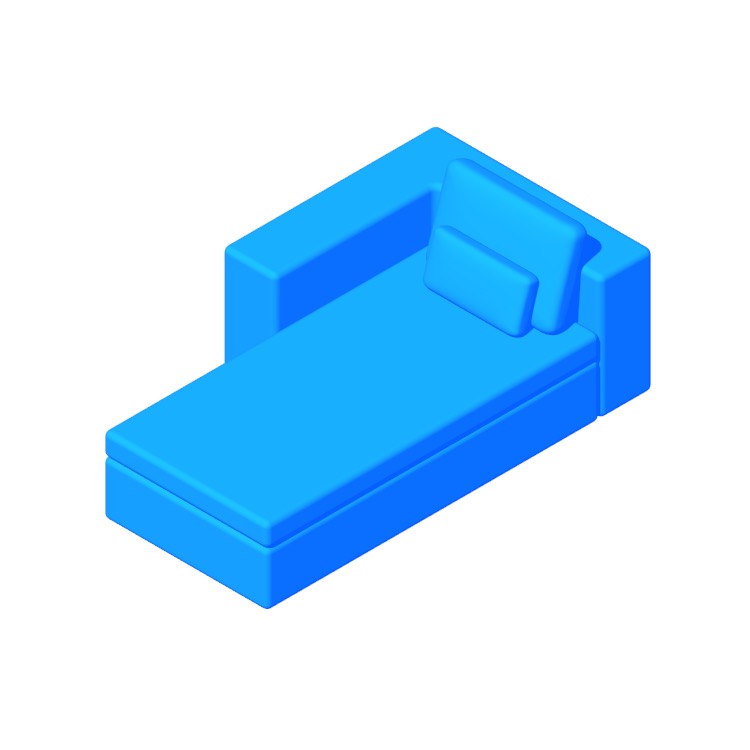
I want to click on space to the left of couch, so click(187, 310).